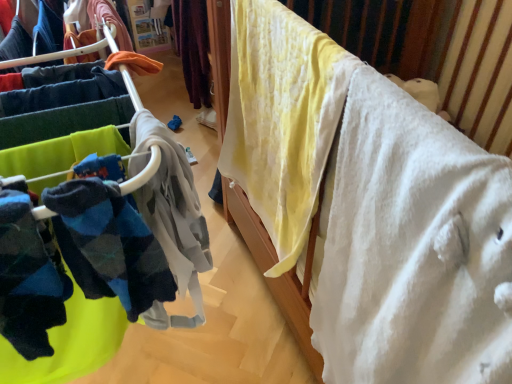
Find the location of `soft fleece socks at left`. soft fleece socks at left is located at coordinates (70, 343).

Are soft fleece socks at left and white soft blanket at upper right far apart?

No.

Where is `closet below the white soft blanket at upper right (from a real-world perspective)`? closet below the white soft blanket at upper right (from a real-world perspective) is located at coordinates click(70, 343).

Is soft fleece socks at left at the left side of white soft blanket at upper right?

Yes, soft fleece socks at left is to the left of white soft blanket at upper right.

From the image's perspective, which is above, soft fleece socks at left or white soft blanket at upper right?

soft fleece socks at left is shown above in the image.

Between yellow cotton blanket at upper right and soft fleece socks at left, which one has smaller width?

With smaller width is yellow cotton blanket at upper right.

Between point (298, 133) and point (106, 350), which one is positioned in front?

The point (106, 350) is in front.

Is yellow cotton blanket at upper right positioned in front of soft fleece socks at left?

No.

From a real-world perspective, relative to soft fleece socks at left, is yellow cotton blanket at upper right vertically above or below?

In terms of real-world spatial position, yellow cotton blanket at upper right is above soft fleece socks at left.

Who is more distant, soft fleece socks at left or yellow cotton blanket at upper right?

yellow cotton blanket at upper right is behind.

Is soft fleece socks at left to the left of yellow cotton blanket at upper right from the viewer's perspective?

Correct, you'll find soft fleece socks at left to the left of yellow cotton blanket at upper right.

Considering the sizes of soft fleece socks at left and yellow cotton blanket at upper right in the image, is soft fleece socks at left taller or shorter than yellow cotton blanket at upper right?

Considering their sizes, soft fleece socks at left has more height than yellow cotton blanket at upper right.

Is white soft blanket at upper right to the right of yellow cotton blanket at upper right from the viewer's perspective?

Indeed, white soft blanket at upper right is positioned on the right side of yellow cotton blanket at upper right.

From a real-world perspective, is white soft blanket at upper right positioned above or below yellow cotton blanket at upper right?

From a real-world perspective, white soft blanket at upper right is physically above yellow cotton blanket at upper right.

Between white soft blanket at upper right and yellow cotton blanket at upper right, which one has smaller size?

With smaller size is yellow cotton blanket at upper right.

Can you see white soft blanket at upper right touching yellow cotton blanket at upper right?

white soft blanket at upper right is not next to yellow cotton blanket at upper right, and they're not touching.

Considering the relative sizes of white soft blanket at upper right and soft fleece socks at left in the image provided, is white soft blanket at upper right bigger than soft fleece socks at left?

Incorrect, white soft blanket at upper right is not larger than soft fleece socks at left.

From a real-world perspective, who is located higher, white soft blanket at upper right or soft fleece socks at left?

white soft blanket at upper right, from a real-world perspective.

Which object is further away from the camera, white soft blanket at upper right or soft fleece socks at left?

white soft blanket at upper right is more distant.

What's the angular difference between white soft blanket at upper right and soft fleece socks at left's facing directions?

white soft blanket at upper right and soft fleece socks at left are facing 2.12 degrees away from each other.

Does yellow cotton blanket at upper right have a smaller size compared to white soft blanket at upper right?

Indeed, yellow cotton blanket at upper right has a smaller size compared to white soft blanket at upper right.

Measure the distance between yellow cotton blanket at upper right and white soft blanket at upper right.

A distance of 6.54 inches exists between yellow cotton blanket at upper right and white soft blanket at upper right.

Considering the relative sizes of yellow cotton blanket at upper right and white soft blanket at upper right in the image provided, is yellow cotton blanket at upper right shorter than white soft blanket at upper right?

No.

From a real-world perspective, does yellow cotton blanket at upper right stand above white soft blanket at upper right?

No, from a real-world perspective, yellow cotton blanket at upper right is not above white soft blanket at upper right.

Identify the location of furniture positioned vertically above the soft fleece socks at left (from a real-world perspective). This screenshot has height=384, width=512. point(412,248).

Identify the location of closet on the left of yellow cotton blanket at upper right. (70, 343).

Looking at the image, which one is located closer to white soft blanket at upper right, yellow cotton blanket at upper right or soft fleece socks at left?

yellow cotton blanket at upper right lies closer to white soft blanket at upper right than the other object.

Consider the image. When comparing their distances from soft fleece socks at left, does yellow cotton blanket at upper right or white soft blanket at upper right seem closer?

The object closer to soft fleece socks at left is white soft blanket at upper right.

Based on their spatial positions, is soft fleece socks at left or white soft blanket at upper right further from yellow cotton blanket at upper right?

soft fleece socks at left is further to yellow cotton blanket at upper right.

Based on their spatial positions, is white soft blanket at upper right or yellow cotton blanket at upper right further from soft fleece socks at left?

Among the two, yellow cotton blanket at upper right is located further to soft fleece socks at left.

Looking at the image, which one is located further to white soft blanket at upper right, soft fleece socks at left or yellow cotton blanket at upper right?

The object further to white soft blanket at upper right is soft fleece socks at left.

Estimate the real-world distances between objects in this image. Which object is closer to yellow cotton blanket at upper right, white soft blanket at upper right or soft fleece socks at left?

The object closer to yellow cotton blanket at upper right is white soft blanket at upper right.

At what (x,y) coordinates should I click in order to perform the action: click on clothing between soft fleece socks at left and white soft blanket at upper right from left to right. Please return your answer as a coordinate pair (x, y). The image size is (512, 384). Looking at the image, I should click on (282, 117).